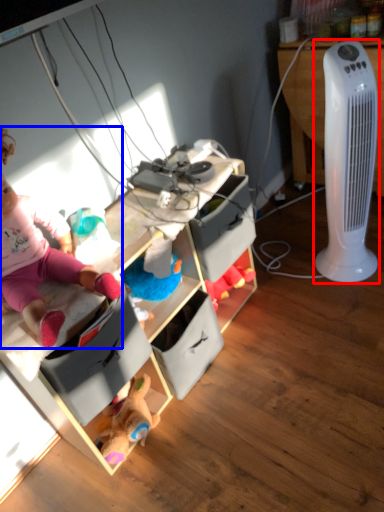
Question: Which object is further to the camera taking this photo, home appliance (highlighted by a red box) or person (highlighted by a blue box)?

Choices:
 (A) home appliance
 (B) person

Answer: (A)